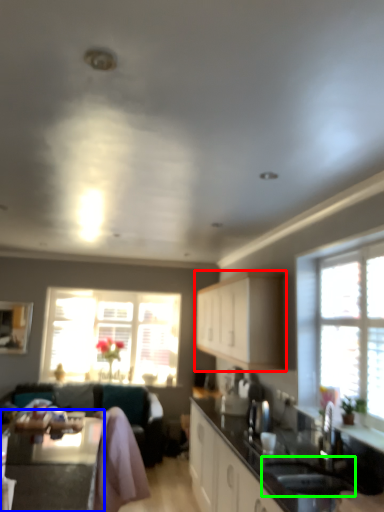
Question: Based on their relative distances, which object is nearer to cabinetry (highlighted by a red box)? Choose from table (highlighted by a blue box) and sink (highlighted by a green box).

Choices:
 (A) table
 (B) sink

Answer: (B)